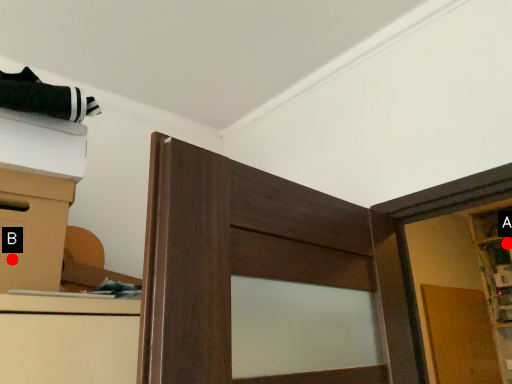
Question: Two points are circled on the image, labeled by A and B beside each circle. Which of the following is the closest to the observer?

Choices:
 (A) A is closer
 (B) B is closer

Answer: (B)